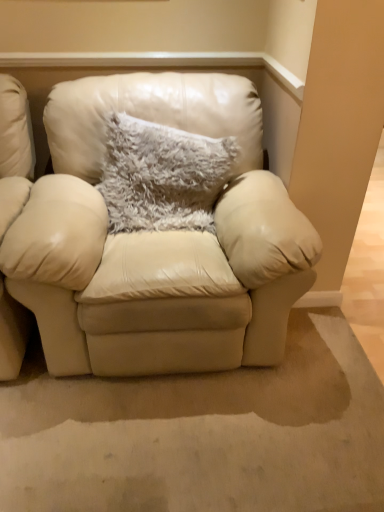
Question: Considering the positions of beige leather chair at left and fuzzy gray pillow at center in the image, is beige leather chair at left wider or thinner than fuzzy gray pillow at center?

Choices:
 (A) thin
 (B) wide

Answer: (B)

Question: From their relative heights in the image, would you say beige leather chair at left is taller or shorter than fuzzy gray pillow at center?

Choices:
 (A) tall
 (B) short

Answer: (A)

Question: Considering the real-world distances, which object is farthest from the matte cream leather armchair at center?

Choices:
 (A) fuzzy gray pillow at center
 (B) beige leather chair at left

Answer: (B)

Question: Estimate the real-world distances between objects in this image. Which object is farther from the fuzzy gray pillow at center?

Choices:
 (A) matte cream leather armchair at center
 (B) beige leather chair at left

Answer: (B)